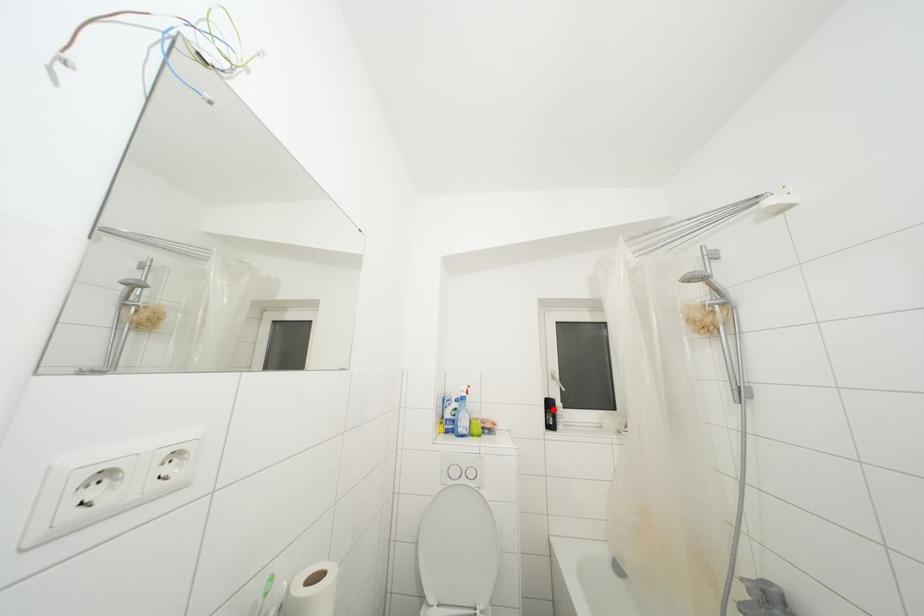
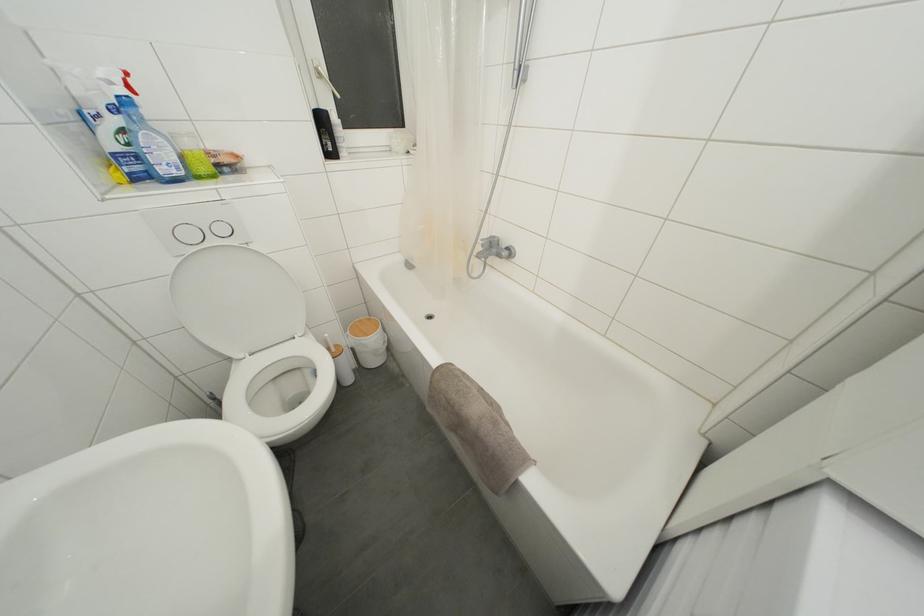
Find the pixel in the second image that matches the highlighted location in the first image.

(325, 126)